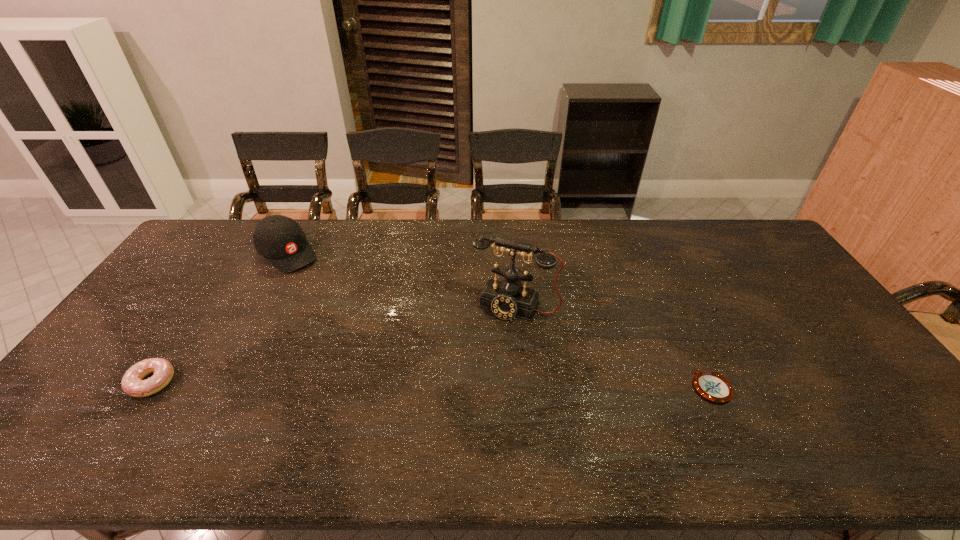
Find the location of `vacant space that's between the baseball cap and the second farthest object`. vacant space that's between the baseball cap and the second farthest object is located at coordinates (401, 280).

This screenshot has height=540, width=960. I want to click on free space between the baseball cap and the telephone, so click(x=401, y=280).

Locate an element on the screen. This screenshot has height=540, width=960. free spot between the third tallest object and the second tallest object is located at coordinates click(x=220, y=318).

Locate an element on the screen. empty space between the compass and the farthest object is located at coordinates (499, 320).

Locate an element on the screen. This screenshot has width=960, height=540. free space between the third object from right to left and the shortest object is located at coordinates (x=499, y=320).

Select which object appears as the second closest to the doughnut. Please provide its 2D coordinates. Your answer should be formatted as a tuple, i.e. [(x, y)], where the tuple contains the x and y coordinates of a point satisfying the conditions above.

[(507, 299)]

Where is `object that is the closest to the leftmost object`? The height and width of the screenshot is (540, 960). object that is the closest to the leftmost object is located at coordinates (279, 239).

I want to click on vacant area that satisfies the following two spatial constraints: 1. on the front side of the baseball cap; 2. on the right side of the compass, so click(217, 387).

Where is `free region that satisfies the following two spatial constraints: 1. on the back side of the third tallest object; 2. on the right side of the tallest object`? free region that satisfies the following two spatial constraints: 1. on the back side of the third tallest object; 2. on the right side of the tallest object is located at coordinates (204, 306).